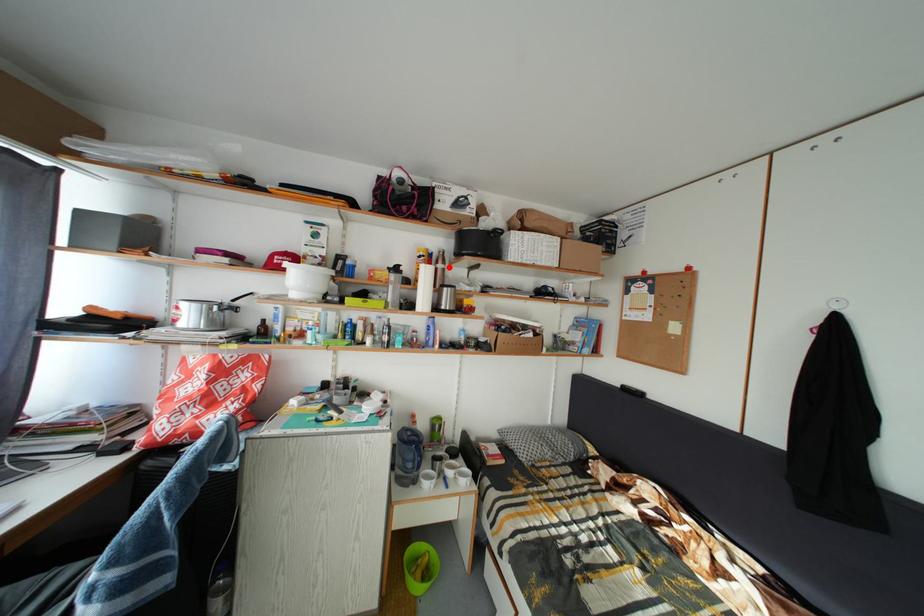
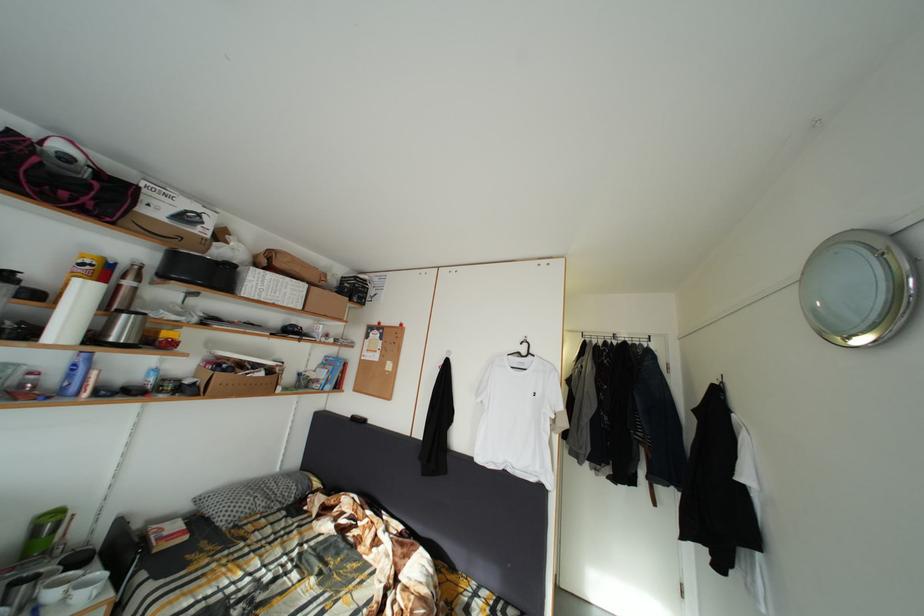
Locate, in the second image, the point that corresponds to the highlighted location in the first image.

(140, 283)